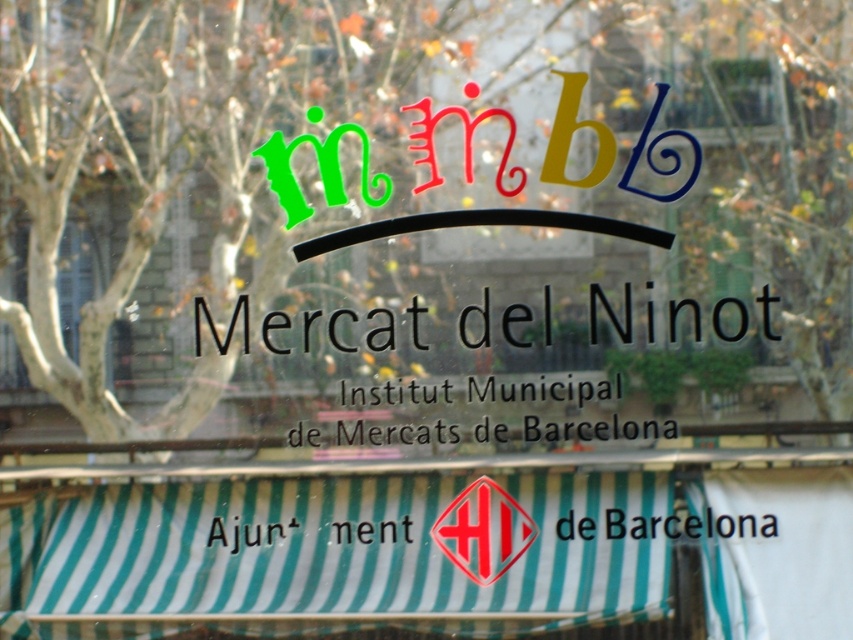
You are a window cleaner holding a 1.2 meter wide cleaning tool. You need to clean the transparent glass sign at center and the black matte mercat del ninot at center. Can your tool fit over both objects at the same time?

The transparent glass sign at center might be wider than black matte mercat del ninot at center, so the tool might fit over both objects if the combined width is within 1.2 meters. However, since the exact widths aren

You are standing in front of a window and see the transparent glass sign at center and the black matte mercat del ninot at center. Which one is positioned to the left?

The transparent glass sign at center is to the left of black matte mercat del ninot at center.

You are an art student analyzing the window design. You notice the red glossy diamond at center and the transparent glass at upper left. Which object appears more prominent in the foreground of the window design?

The red glossy diamond at center appears more prominent in the foreground because it is closer to the viewer than the transparent glass at upper left.